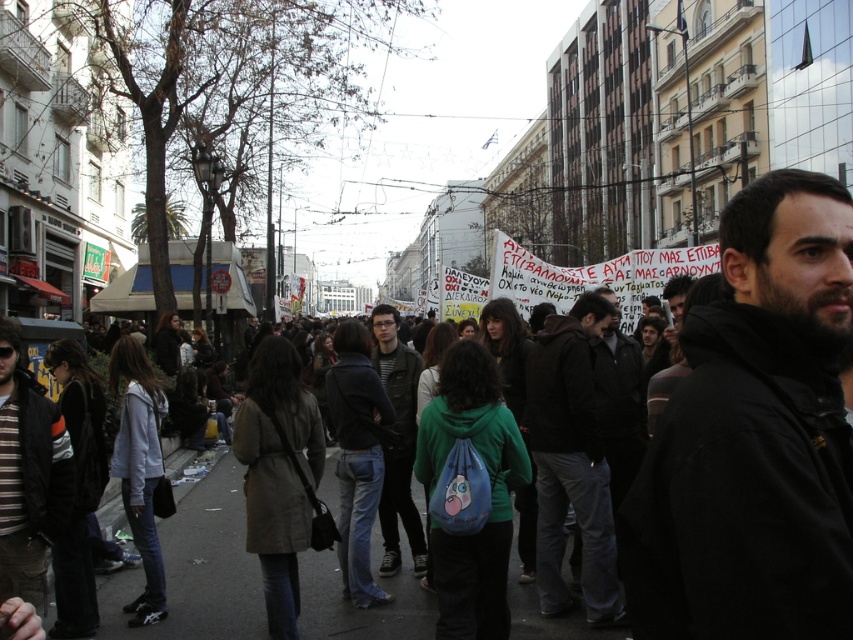
Does black matte jacket at center appear under dark gray pants at center?

Incorrect, black matte jacket at center is not positioned below dark gray pants at center.

Does point (677, 582) come behind point (561, 429)?

That is False.

Is point (697, 312) closer to camera compared to point (550, 556)?

Yes.

I want to click on black matte jacket at center, so click(755, 435).

Is point (666, 577) closer to camera compared to point (398, 358)?

Yes, it is in front of point (398, 358).

Does black matte jacket at center have a lesser height compared to dark green jacket at center?

Correct, black matte jacket at center is not as tall as dark green jacket at center.

Is point (671, 477) closer to camera compared to point (422, 547)?

Yes, point (671, 477) is closer to viewer.

The width and height of the screenshot is (853, 640). I want to click on black matte jacket at center, so click(755, 435).

Who is positioned more to the right, striped cotton shirt at left or dark green jacket at center?

dark green jacket at center is more to the right.

The image size is (853, 640). What do you see at coordinates (28, 476) in the screenshot?
I see `striped cotton shirt at left` at bounding box center [28, 476].

You are a GUI agent. You are given a task and a screenshot of the screen. Output one action in this format:
    pyautogui.click(x=<x>, y=<y>)
    Task: Click on the striped cotton shirt at left
    The height and width of the screenshot is (640, 853).
    Given the screenshot: What is the action you would take?
    tap(28, 476)